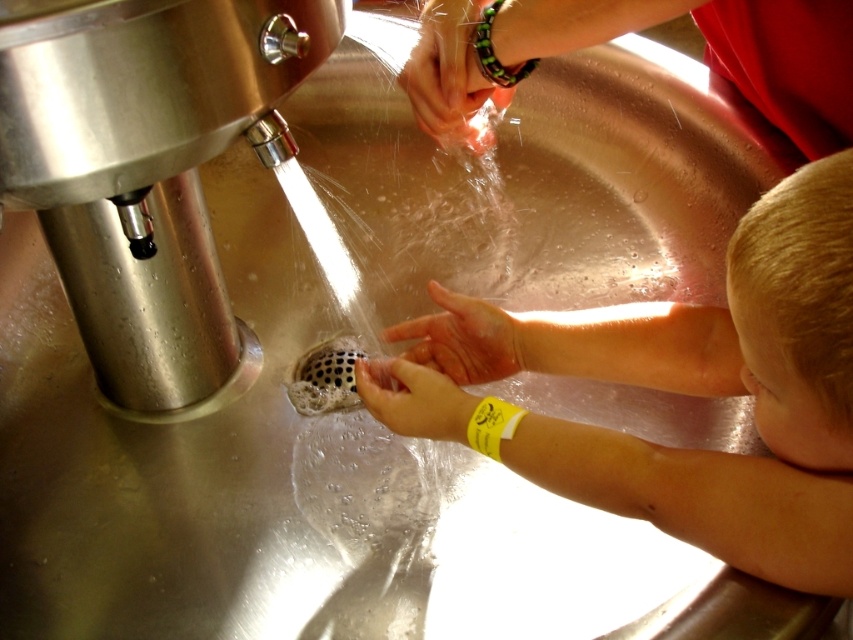
Which is more to the right, matte black bracelet at upper center or yellow rubber band at lower center?

matte black bracelet at upper center

Does matte black bracelet at upper center lie in front of yellow rubber band at lower center?

No, it is behind yellow rubber band at lower center.

This screenshot has height=640, width=853. Describe the element at coordinates (450, 76) in the screenshot. I see `matte black bracelet at upper center` at that location.

The image size is (853, 640). Identify the location of matte black bracelet at upper center. (450, 76).

Does smooth skin hands at center appear under satin nickel faucet at lower left?

Correct, smooth skin hands at center is located below satin nickel faucet at lower left.

This screenshot has height=640, width=853. What do you see at coordinates (701, 390) in the screenshot?
I see `smooth skin hands at center` at bounding box center [701, 390].

You are a GUI agent. You are given a task and a screenshot of the screen. Output one action in this format:
    pyautogui.click(x=<x>, y=<y>)
    Task: Click on the smooth skin hands at center
    The height and width of the screenshot is (640, 853).
    Given the screenshot: What is the action you would take?
    pyautogui.click(x=701, y=390)

Is satin nickel faucet at lower left bigger than matte black bracelet at upper center?

Yes.

Is point (169, 369) positioned in front of point (465, 77)?

That is False.

The height and width of the screenshot is (640, 853). Describe the element at coordinates (148, 172) in the screenshot. I see `satin nickel faucet at lower left` at that location.

Image resolution: width=853 pixels, height=640 pixels. Identify the location of satin nickel faucet at lower left. (148, 172).